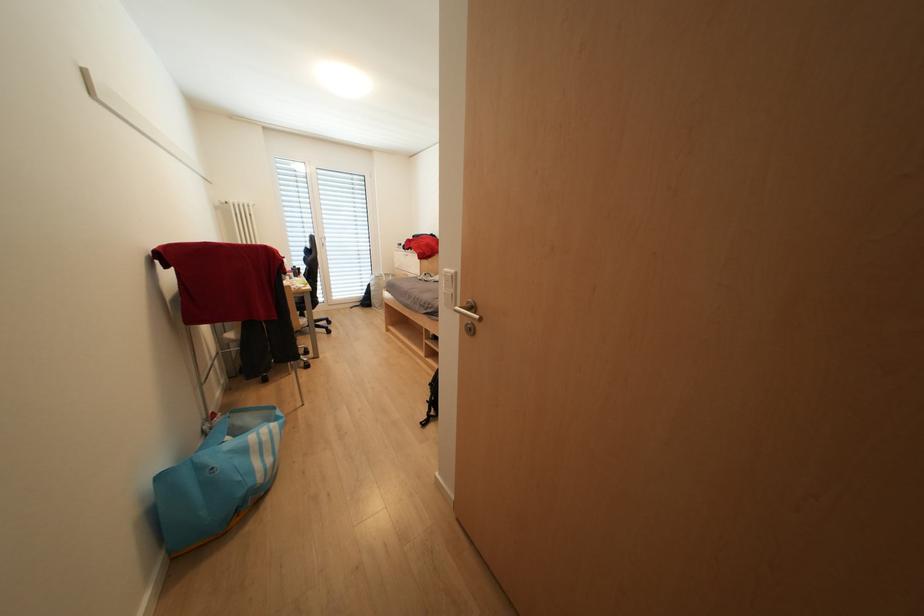
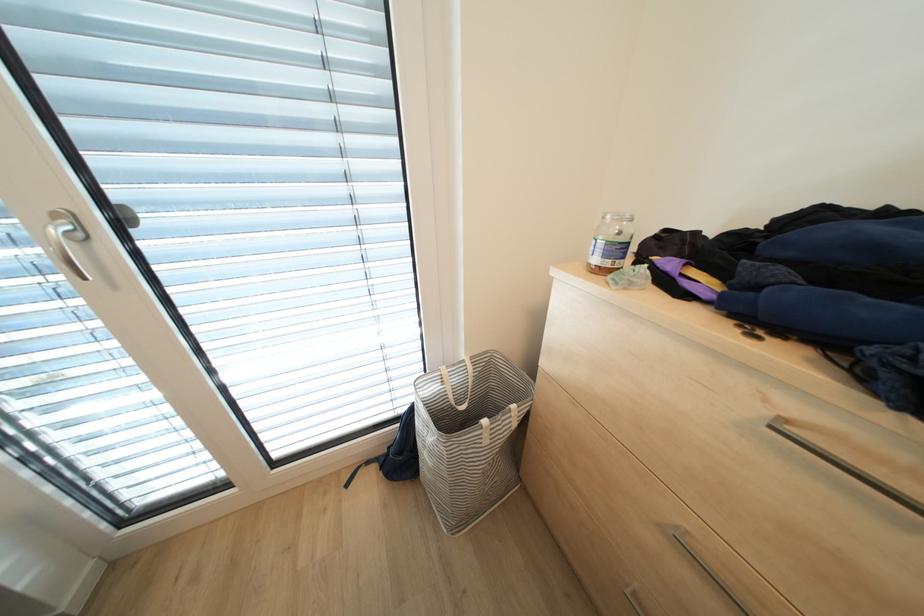
The images are taken continuously from a first-person perspective. In which direction are you moving?

The movement direction of the cameraman is left, forward.